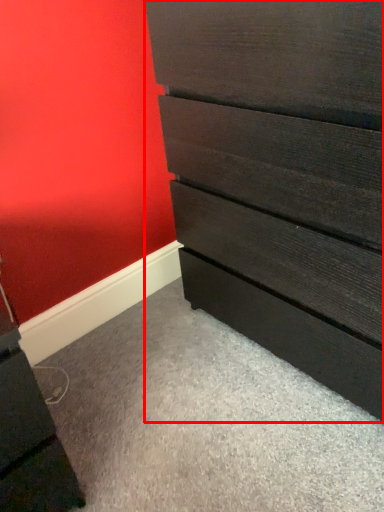
Question: From the image's perspective, what is the correct spatial relationship of chest of drawers (annotated by the red box) in relation to file cabinet?

Choices:
 (A) below
 (B) above

Answer: (B)